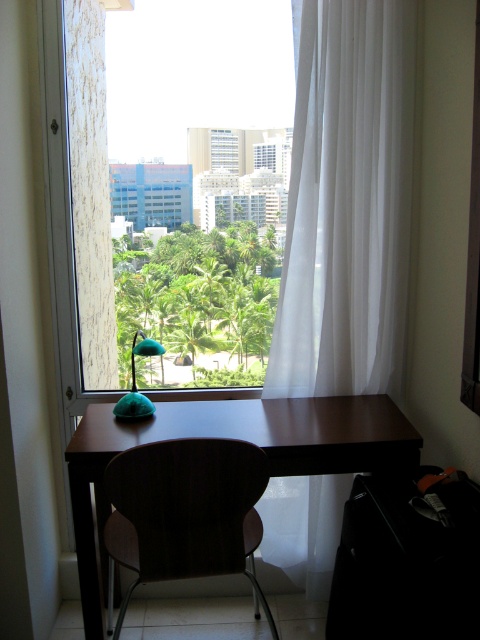
Question: Which point is closer to the camera?

Choices:
 (A) (120, 621)
 (B) (100, 468)
 (C) (134, 396)
 (D) (361, 284)

Answer: (B)

Question: Among these points, which one is nearest to the camera?

Choices:
 (A) (229, 452)
 (B) (273, 385)

Answer: (A)

Question: Is transparent glass window at center smaller than wooden chair at center?

Choices:
 (A) no
 (B) yes

Answer: (A)

Question: Can you confirm if white sheer curtain at right is positioned below teal fabric lamp at lower left?

Choices:
 (A) no
 (B) yes

Answer: (A)

Question: Which object is the farthest from the teal fabric lamp at lower left?

Choices:
 (A) dark wood table at center
 (B) wooden chair at center

Answer: (B)

Question: Does white sheer curtain at right lie behind dark wood table at center?

Choices:
 (A) no
 (B) yes

Answer: (B)